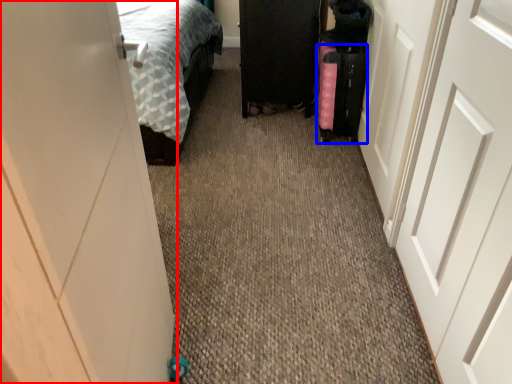
Question: Which point is further to the camera, door (highlighted by a red box) or luggage (highlighted by a blue box)?

Choices:
 (A) door
 (B) luggage

Answer: (B)